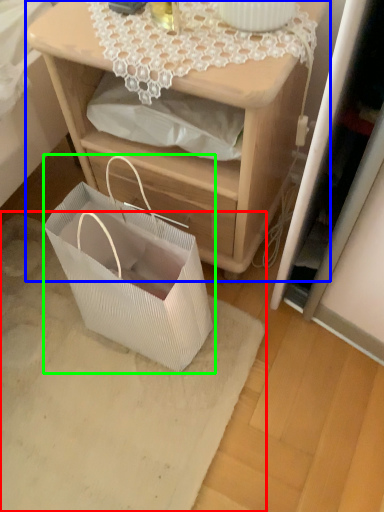
Question: Which object is positioned farthest from mat (highlighted by a red box)? Select from nightstand (highlighted by a blue box) and gift basket (highlighted by a green box).

Choices:
 (A) nightstand
 (B) gift basket

Answer: (A)